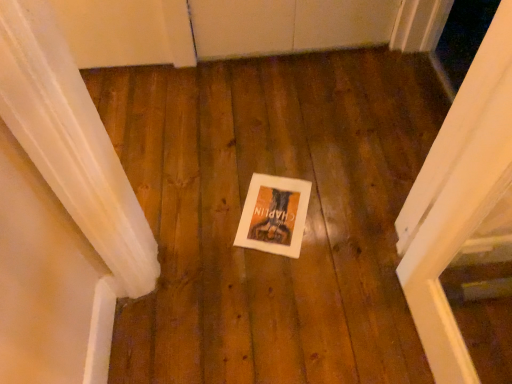
The height and width of the screenshot is (384, 512). What are the coordinates of `white paper at center` in the screenshot? It's located at (274, 215).

Describe the element at coordinates (274, 215) in the screenshot. I see `white paper at center` at that location.

Locate an element on the screen. white paper at center is located at coordinates (274, 215).